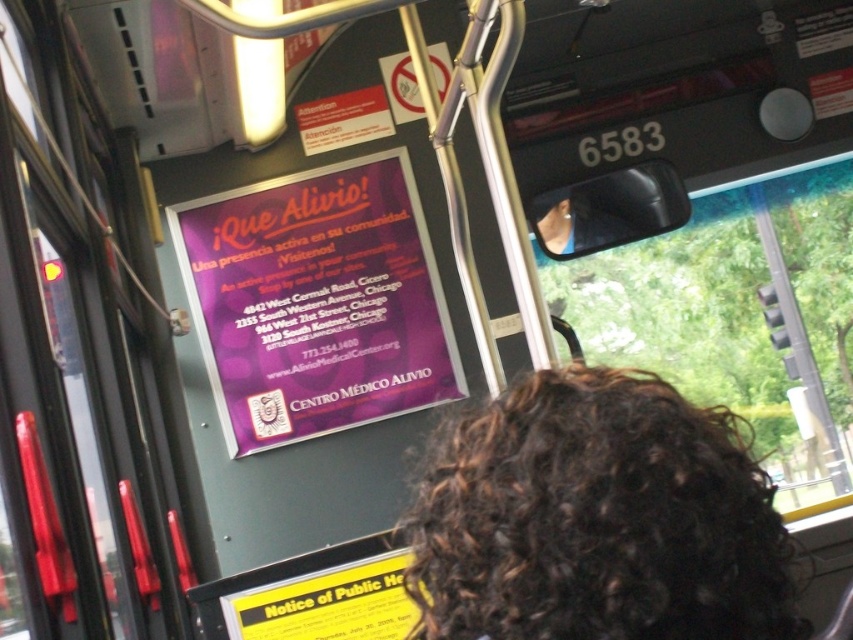
You are a passenger on the bus and want to read the yellow paper notice of public health at lower center. Can you see it through the transparent glass window at upper center?

The transparent glass window at upper center might be wider than yellow paper notice of public health at lower center, so it is possible that the yellow paper notice of public health at lower center is visible through the transparent glass window at upper center depending on their exact positions and angles.

You are a bus driver who needs to check both the purple glossy poster at upper center and the transparent glass window at upper center during your route. Given that your line of sight is limited to 4 meters, can you view both objects without moving your head?

The distance between the purple glossy poster at upper center and the transparent glass window at upper center is 5.03 meters. Since your line of sight is limited to 4 meters, you cannot view both objects without moving your head.

You are a passenger on the bus and want to read the purple glossy poster at upper center. There is also a transparent glass window at upper center. Which one is wider?

The purple glossy poster at upper center has a lesser width compared to transparent glass window at upper center, so the transparent glass window at upper center is wider.